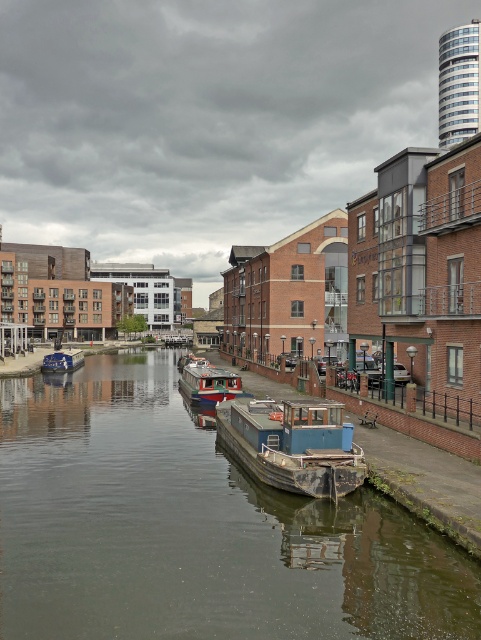
You are a delivery person trying to cross the canal using a small boat that requires at least 3 meters of clearance between the smooth concrete river at center and the blue weathered barge at center. Can you safely navigate your boat through this space?

The smooth concrete river at center is 3.15 meters from the blue weathered barge at center, which is just enough clearance for the boat requiring 3 meters. Therefore, you can safely navigate your boat through this space.

You are a delivery person trying to navigate a narrow bridge that is 2 meters tall. You have a blue weathered barge at center and a red glossy boat at center. Which vessel can pass under the bridge without any issues?

The red glossy boat at center can pass under the bridge without issues since it has a lower height compared to the blue weathered barge at center, which is taller and may hit the bridge.

You are a delivery person who needs to cross the canal using a bridge that is exactly as wide as the smooth concrete river at center. Can your delivery van, which is as wide as the red glossy boat at center, safely pass through the bridge without any modifications?

The smooth concrete river at center is wider than the red glossy boat at center. Since the bridge is as wide as the river, the van, being the same width as the boat, can safely pass through the bridge.